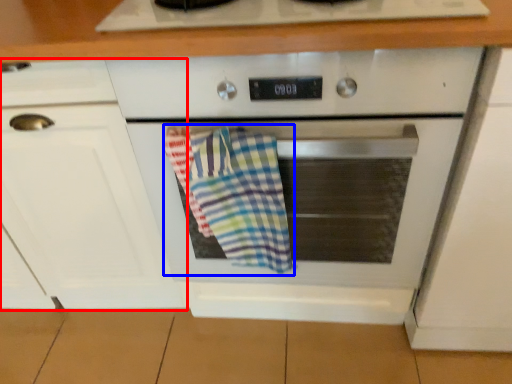
Question: Which point is further to the camera, cabinetry (highlighted by a red box) or beach towel (highlighted by a blue box)?

Choices:
 (A) cabinetry
 (B) beach towel

Answer: (B)